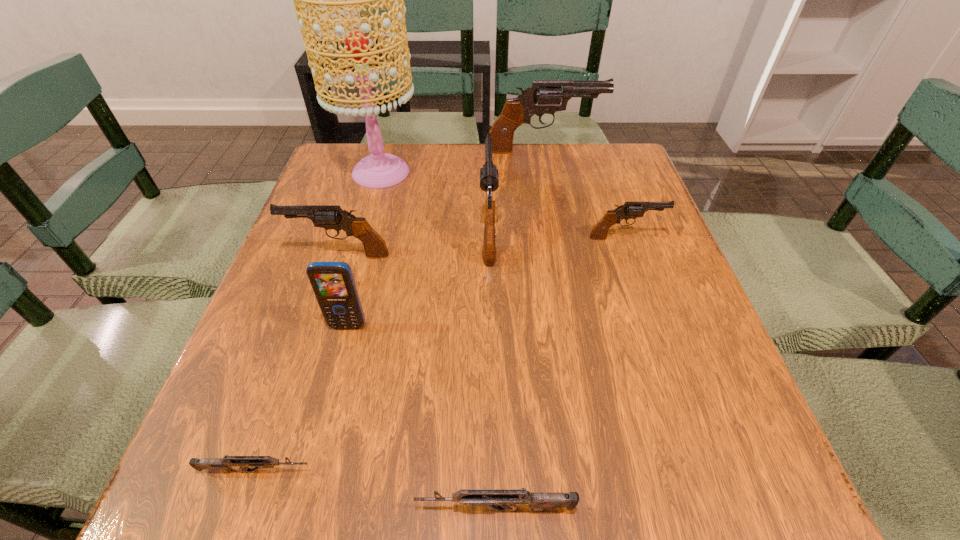
Identify which black gun is the third closest to the nearest gun. Please provide its 2D coordinates. Your answer should be formatted as a tuple, i.e. [(x, y)], where the tuple contains the x and y coordinates of a point satisfying the conditions above.

[(629, 210)]